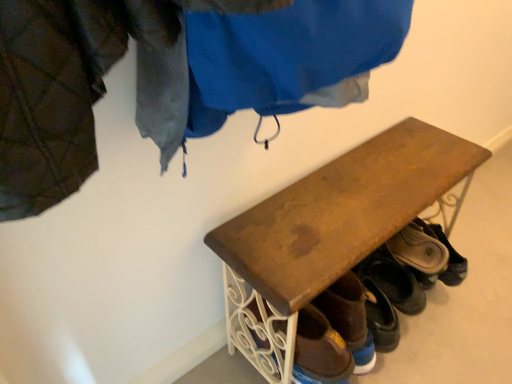
Question: Relative to wooden bench at center, is brown suede shoe at lower right, the 1th footwear viewed from the right, in front or behind?

Choices:
 (A) front
 (B) behind

Answer: (B)

Question: From a real-world perspective, is brown suede shoe at lower right, the 3th footwear from the front, positioned above or below wooden bench at center?

Choices:
 (A) above
 (B) below

Answer: (B)

Question: Which is farther from the brown suede shoe at lower right, which is counted as the 3th footwear, starting from the left?

Choices:
 (A) wooden bench at center
 (B) brown leather shoe at lower right, the second footwear in the left-to-right sequence
 (C) brown leather shoe at lower center, the first footwear when ordered from left to right

Answer: (A)

Question: Estimate the real-world distances between objects in this image. Which object is closer to the wooden bench at center?

Choices:
 (A) brown leather shoe at lower right, the second footwear in the left-to-right sequence
 (B) brown suede shoe at lower right, arranged as the 1th footwear when viewed from the back
 (C) brown leather shoe at lower center, arranged as the 3th footwear when viewed from the right

Answer: (C)